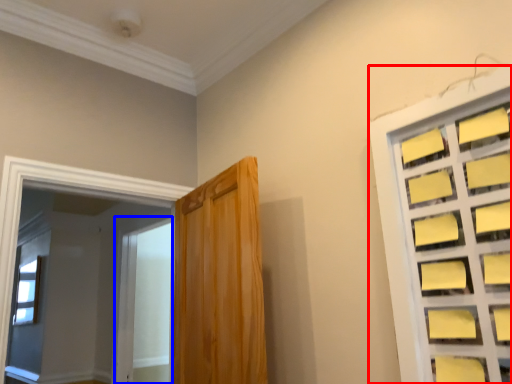
Question: Among these objects, which one is farthest to the camera, window (highlighted by a red box) or screen door (highlighted by a blue box)?

Choices:
 (A) window
 (B) screen door

Answer: (B)